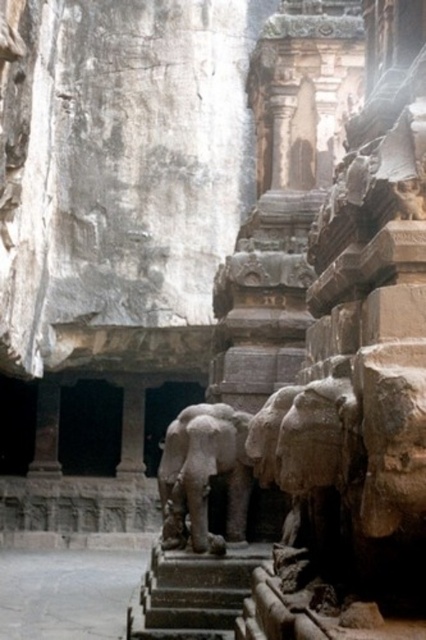
Can you confirm if gray stone elephant at center is thinner than dark gray stone stairs at center?

Yes.

Is gray stone elephant at center further to the viewer compared to dark gray stone stairs at center?

Yes, it is.

Does point (236, 445) come in front of point (241, 570)?

No, it is not.

Find the location of a particular element. This screenshot has width=426, height=640. gray stone elephant at center is located at coordinates (203, 474).